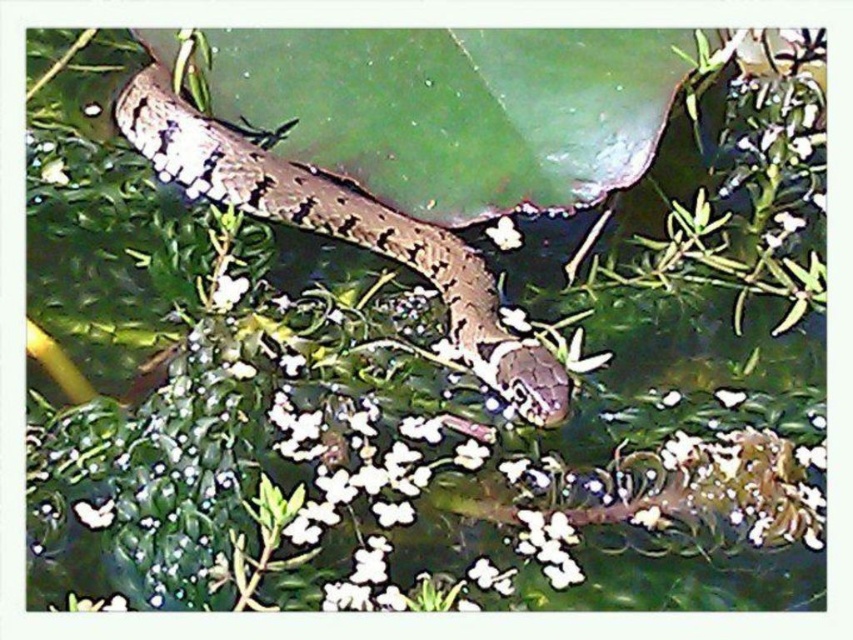
In the scene shown: Between speckled brown snake at center and white matte flower at center, which one appears on the left side from the viewer's perspective?

From the viewer's perspective, white matte flower at center appears more on the left side.

Does speckled brown snake at center have a smaller size compared to white matte flower at center?

Actually, speckled brown snake at center might be larger than white matte flower at center.

The width and height of the screenshot is (853, 640). In order to click on speckled brown snake at center in this screenshot , I will do `click(341, 230)`.

Is white matte flower at center bigger than white matte flower at upper center?

Actually, white matte flower at center might be smaller than white matte flower at upper center.

Is point (241, 296) behind point (515, 241)?

No, it is in front of (515, 241).

You are a GUI agent. You are given a task and a screenshot of the screen. Output one action in this format:
    pyautogui.click(x=<x>, y=<y>)
    Task: Click on the white matte flower at center
    This screenshot has height=640, width=853.
    Given the screenshot: What is the action you would take?
    pyautogui.click(x=227, y=291)

Who is positioned more to the right, speckled brown snake at center or white matte flower at upper center?

From the viewer's perspective, white matte flower at upper center appears more on the right side.

Is point (126, 104) closer to camera compared to point (491, 230)?

Yes, it is in front of point (491, 230).

You are a GUI agent. You are given a task and a screenshot of the screen. Output one action in this format:
    pyautogui.click(x=<x>, y=<y>)
    Task: Click on the speckled brown snake at center
    This screenshot has height=640, width=853.
    Given the screenshot: What is the action you would take?
    pyautogui.click(x=341, y=230)